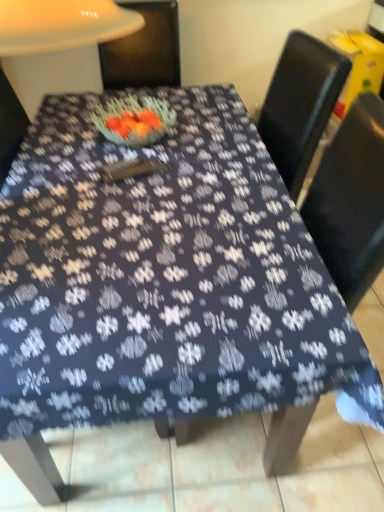
What do you see at coordinates (351, 201) in the screenshot? This screenshot has width=384, height=512. I see `black leather chair at center` at bounding box center [351, 201].

Locate an element on the screen. The width and height of the screenshot is (384, 512). black leather chair at center is located at coordinates (351, 201).

The height and width of the screenshot is (512, 384). Identify the location of black leather chair at center. (351, 201).